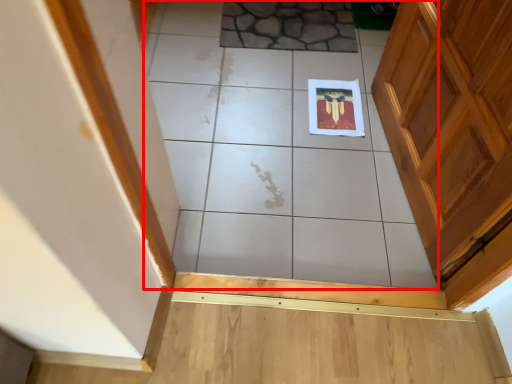
Question: From the image's perspective, considering the relative positions of ceramic tile (annotated by the red box) and ceramic tile in the image provided, where is ceramic tile (annotated by the red box) located with respect to the staircase?

Choices:
 (A) above
 (B) below

Answer: (B)